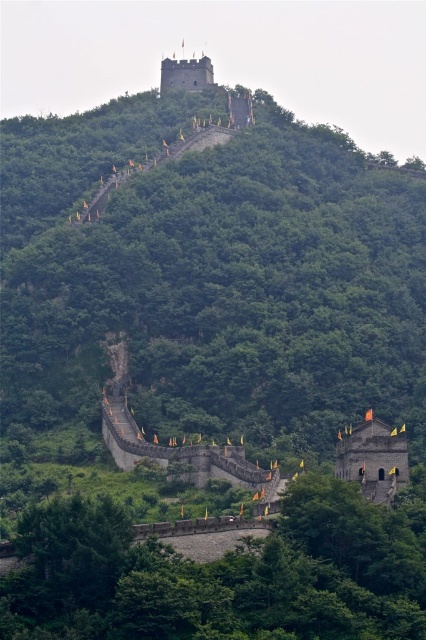
You are a tour guide leading a group to the top of the hill. The group wants to know how far they have to walk from the stone wall at center to the smooth gray stone tower at upper center. Can you provide them with the distance in meters?

The stone wall at center and smooth gray stone tower at upper center are 305.48 feet apart, which converts to approximately 93.1 meters. Therefore, the distance they need to walk is about 93.1 meters.

You are a hiker on the Great Wall and want to reach the top of the hill. You see a rustic stone tower at center and a smooth gray stone tower at upper center. Which tower should you head towards to reach the summit?

You should head towards the smooth gray stone tower at upper center because it is located at the summit, above the rustic stone tower at center.

You are standing at the base of the Great Wall and want to reach the rustic stone tower at center. According to the coordinates provided in the Objects Description, in which direction should you head to reach it?

The rustic stone tower at center is located at coordinates point (373, 458), which means it is positioned towards the upper right direction from your current position at the base. You should head upwards and towards the right to reach it.